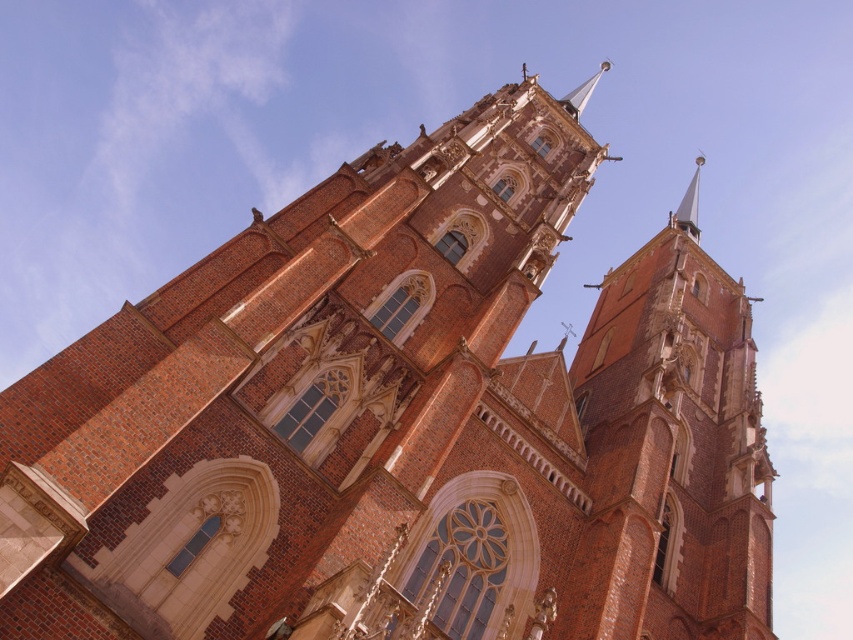
Question: Is the position of matte brick tower at right less distant than that of smooth gold spire at upper right?

Choices:
 (A) yes
 (B) no

Answer: (A)

Question: Does matte brick tower at right have a lesser width compared to smooth gold spire at upper right?

Choices:
 (A) yes
 (B) no

Answer: (A)

Question: From the image, what is the correct spatial relationship of matte brick tower at right in relation to smooth gold spire at upper right?

Choices:
 (A) left
 (B) right

Answer: (A)